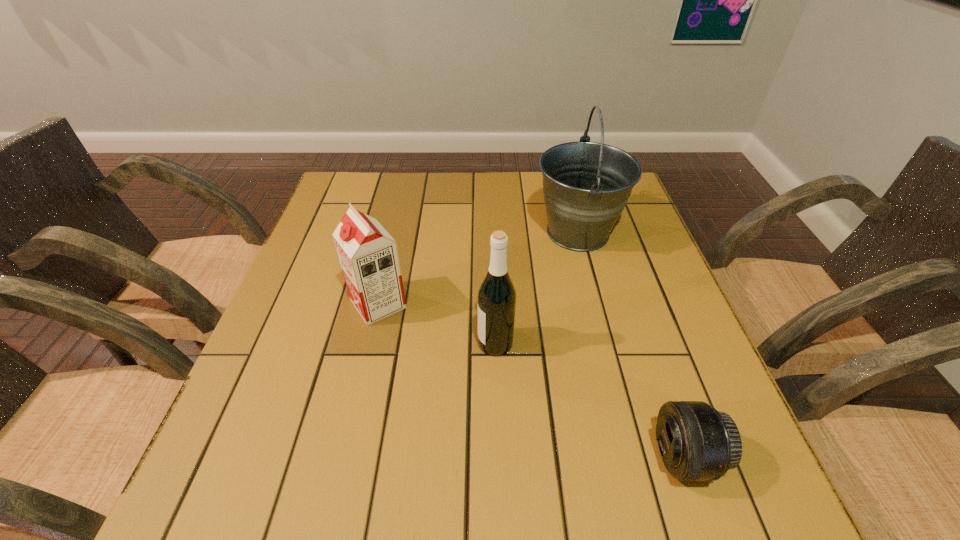
At what (x,y) coordinates should I click in order to perform the action: click on telephoto lens present at the right edge. Please return your answer as a coordinate pair (x, y). The width and height of the screenshot is (960, 540). Looking at the image, I should click on (697, 443).

Find the location of a particular element. object at the far right corner is located at coordinates (586, 185).

You are a GUI agent. You are given a task and a screenshot of the screen. Output one action in this format:
    pyautogui.click(x=<x>, y=<y>)
    Task: Click on the object that is at the near right corner
    
    Given the screenshot: What is the action you would take?
    pyautogui.click(x=697, y=443)

At what (x,y) coordinates should I click in order to perform the action: click on vacant area at the far edge of the desktop. Please return your answer as a coordinate pair (x, y). Looking at the image, I should click on (396, 190).

In the image, there is a desktop. Where is `vacant space at the left edge`? vacant space at the left edge is located at coordinates (338, 280).

The height and width of the screenshot is (540, 960). In the image, there is a desktop. Identify the location of free space at the right edge. (670, 362).

What are the coordinates of `vacant space at the far left corner of the desktop` in the screenshot? It's located at (336, 184).

Locate an element on the screen. vacant region at the near left corner is located at coordinates (289, 477).

This screenshot has height=540, width=960. In order to click on vacant area at the near right corner in this screenshot , I will do `click(731, 514)`.

The width and height of the screenshot is (960, 540). I want to click on free space between the farthest object and the shortest object, so click(631, 345).